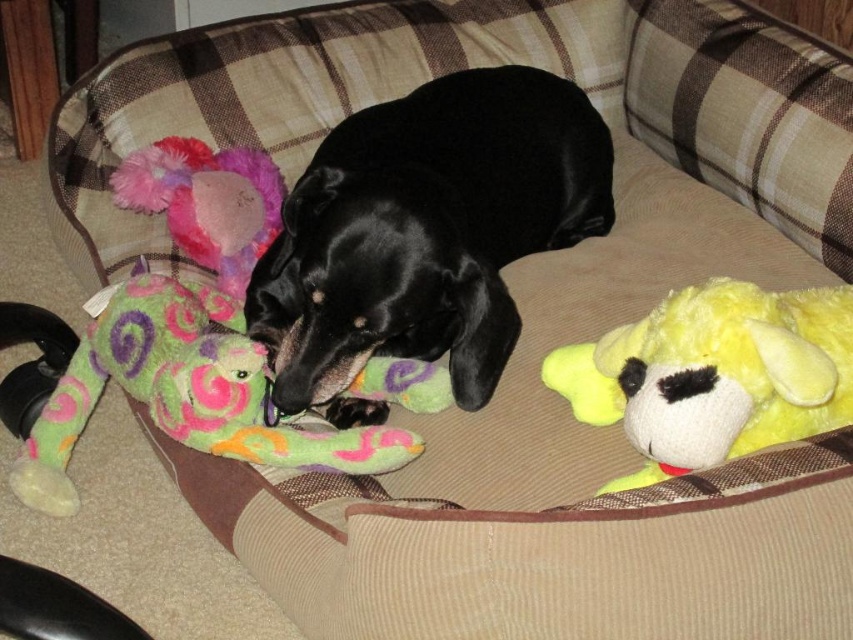
Question: Observing the image, what is the correct spatial positioning of black glossy dog at center in reference to fluffy plush toy at upper left?

Choices:
 (A) below
 (B) above

Answer: (A)

Question: Estimate the real-world distances between objects in this image. Which object is farther from the black glossy dog at center?

Choices:
 (A) fluffy plush toy at upper left
 (B) yellow plush dog at right

Answer: (B)

Question: Which point appears farthest from the camera in this image?

Choices:
 (A) click(405, 296)
 (B) click(647, 417)
 (C) click(213, 436)
 (D) click(142, 204)

Answer: (D)

Question: In this image, where is multicolored plush toy at left located relative to fluffy plush toy at upper left?

Choices:
 (A) left
 (B) right

Answer: (B)

Question: Does black glossy dog at center have a smaller size compared to fluffy plush toy at upper left?

Choices:
 (A) yes
 (B) no

Answer: (B)

Question: Which of the following is the closest to the observer?

Choices:
 (A) black glossy dog at center
 (B) yellow plush dog at right
 (C) fluffy plush toy at upper left

Answer: (B)